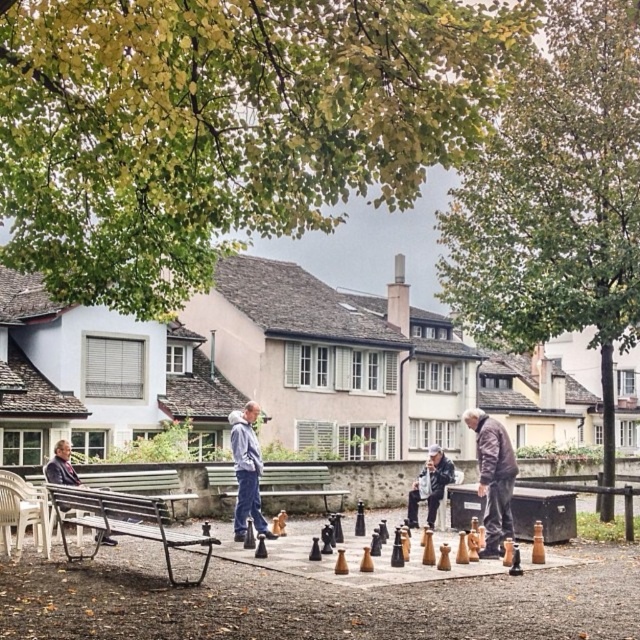
Can you confirm if white plastic bench at lower left is positioned above wooden bench at left?

Indeed, white plastic bench at lower left is positioned over wooden bench at left.

Consider the image. Is white plastic bench at lower left bigger than wooden bench at left?

No, white plastic bench at lower left is not bigger than wooden bench at left.

The height and width of the screenshot is (640, 640). Find the location of `white plastic bench at lower left`. white plastic bench at lower left is located at coordinates [20, 513].

How far apart are white plastic bench at lower left and dark gray fabric jacket at lower center?

white plastic bench at lower left and dark gray fabric jacket at lower center are 6.82 meters apart.

Which is more to the right, white plastic bench at lower left or dark gray fabric jacket at lower center?

Positioned to the right is dark gray fabric jacket at lower center.

This screenshot has height=640, width=640. In order to click on white plastic bench at lower left in this screenshot , I will do `click(20, 513)`.

Between wooden bench at center and wooden bench at left, which one has more height?

wooden bench at center is taller.

Between wooden bench at center and wooden bench at left, which one is positioned lower?

wooden bench at center

Between point (234, 496) and point (118, 480), which one is positioned in front?

Positioned in front is point (118, 480).

Locate an element on the screen. This screenshot has width=640, height=640. wooden bench at center is located at coordinates (300, 483).